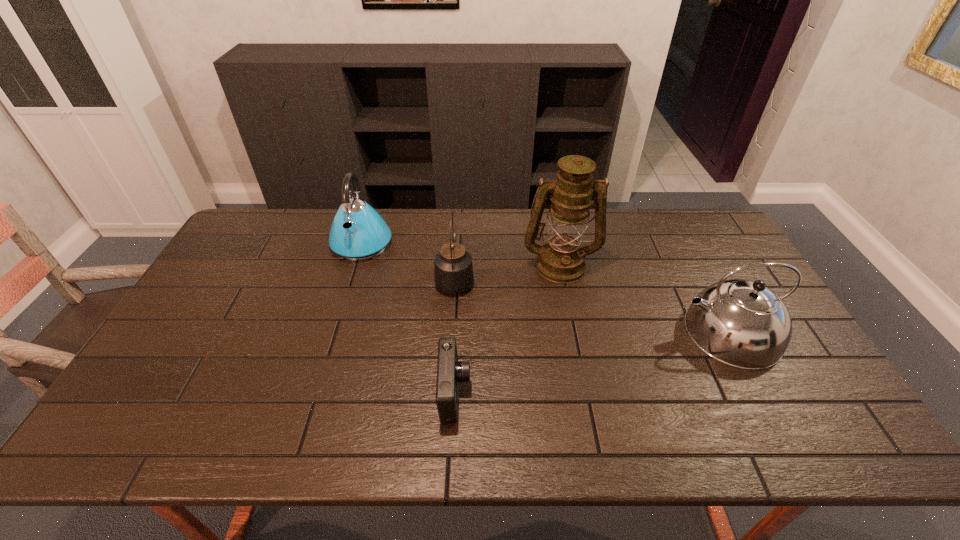
Locate an element on the screen. The height and width of the screenshot is (540, 960). oil lamp is located at coordinates (562, 260).

Where is `the tallest object`? This screenshot has height=540, width=960. the tallest object is located at coordinates (562, 260).

Find the location of a particular element. the leftmost kettle is located at coordinates (358, 232).

Find the location of a particular element. The height and width of the screenshot is (540, 960). the second kettle from right to left is located at coordinates (453, 271).

I want to click on the rightmost kettle, so click(x=741, y=323).

This screenshot has width=960, height=540. I want to click on the nearest kettle, so click(x=741, y=323).

The image size is (960, 540). I want to click on camera, so click(449, 371).

Where is `vacant position located 0.060m on the left of the fourth object from left to right`? The image size is (960, 540). vacant position located 0.060m on the left of the fourth object from left to right is located at coordinates (503, 264).

Find the location of a particular element. The image size is (960, 540). free space located at the spout of the leftmost kettle is located at coordinates (342, 308).

Identify the location of free space located 0.260m spout on the second kettle from right to left. (459, 215).